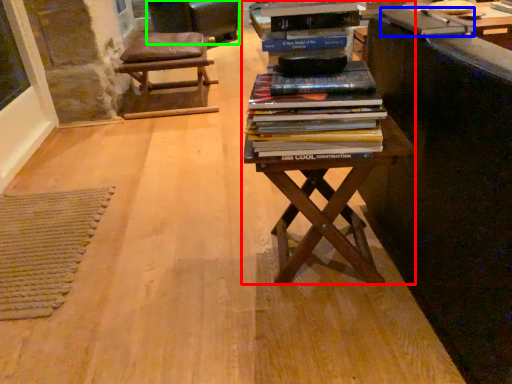
Question: Considering the real-world distances, which object is farthest from table (highlighted by a red box)? paperback book (highlighted by a blue box) or rocking chair (highlighted by a green box)?

Choices:
 (A) paperback book
 (B) rocking chair

Answer: (B)